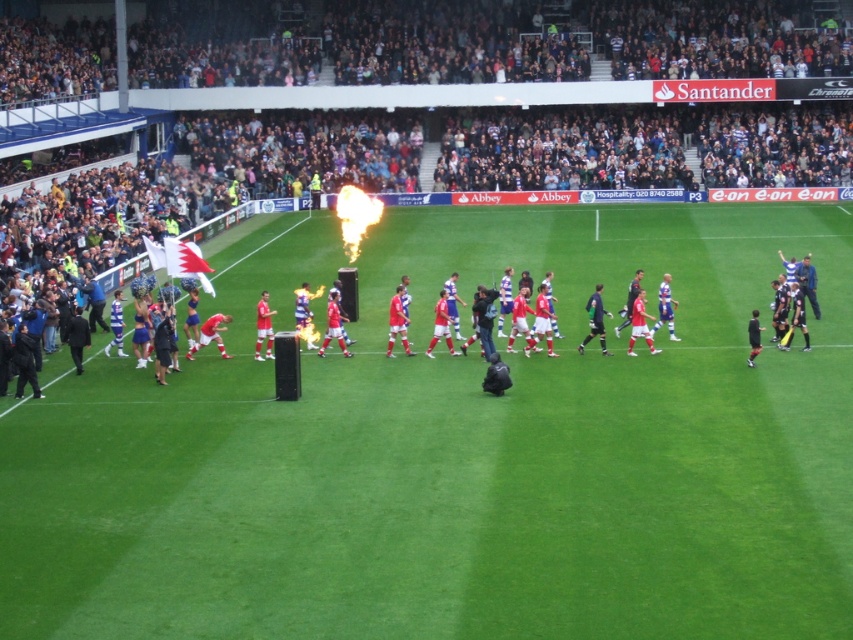
You are a photographer at the football stadium. You need to capture a photo that includes both the green grass field at center and the smooth plastic flag at upper left. Based on their positions, where should you position yourself to ensure both are visible in the frame?

To capture both the green grass field at center and the smooth plastic flag at upper left, position yourself so that the camera is angled upward from the field towards the flag. Since the green grass field at center is positioned under the smooth plastic flag at upper left, this angle will ensure both elements are in the frame.

Looking at this image, you are a drone operator trying to capture aerial footage of the football stadium. Your drone is currently hovering above the green grass field at center. The smooth plastic flag at upper left is part of a safety zone that your drone must not enter. Given the minimum safe distance your drone can maintain from the flag is 15 meters, will your drone be in compliance with safety regulations?

The distance between the green grass field at center and the smooth plastic flag at upper left is 15.46 meters, which is just over the required 15 meters minimum safe distance. Therefore, the drone is compliant with safety regulations as it maintains the necessary distance from the flag.

You are a drone operator trying to capture the best aerial shot of the green grass field at center. You need to position your drone at point (459,454). Will this point be over the green grass field at center?

Yes, the point (459,454) corresponds to the green grass field at center, so positioning the drone there will be over the green grass field at center.